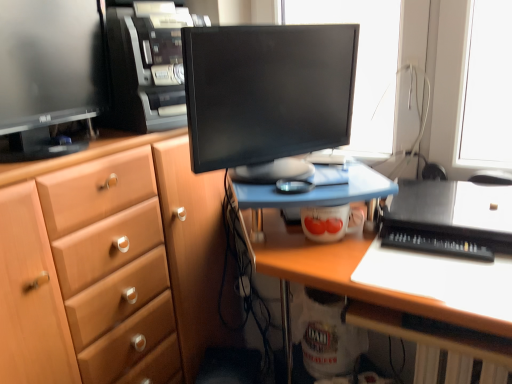
Question: In terms of width, does black glossy monitor at center, which is the first computer monitor in right-to-left order, look wider or thinner when compared to matte wood cabinet at left?

Choices:
 (A) thin
 (B) wide

Answer: (A)

Question: Considering their positions, is black glossy monitor at center, which is the first computer monitor in right-to-left order, located in front of or behind matte wood cabinet at left?

Choices:
 (A) front
 (B) behind

Answer: (B)

Question: Estimate the real-world distances between objects in this image. Which object is farther from the black glossy monitor at center, which is the first computer monitor in right-to-left order?

Choices:
 (A) black plastic computer tower at upper center
 (B) matte black monitor at left, which is the first computer monitor from left to right
 (C) black plastic keyboard at lower right
 (D) matte wood cabinet at left
 (E) wooden desk at center

Answer: (C)

Question: Which is farther from the black plastic computer tower at upper center?

Choices:
 (A) black plastic keyboard at lower right
 (B) matte wood cabinet at left
 (C) matte black monitor at left, the 2th computer monitor from the right
 (D) black glossy monitor at center, which is the first computer monitor in right-to-left order
 (E) wooden desk at center

Answer: (A)